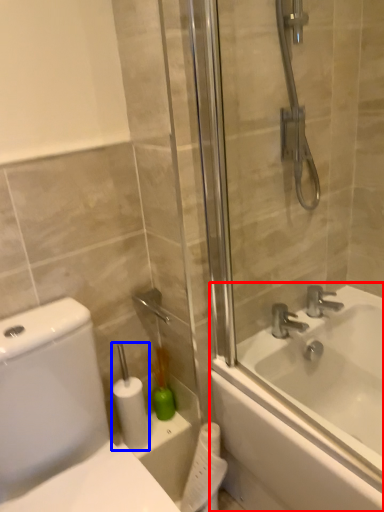
Question: Which point is closer to the camera, bathtub (highlighted by a red box) or toilet paper (highlighted by a blue box)?

Choices:
 (A) bathtub
 (B) toilet paper

Answer: (A)